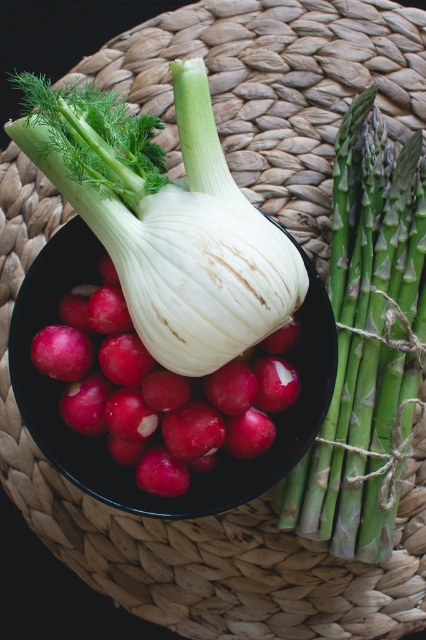
You are standing in front of a vegetable display and see a point marked at coordinates (368, 342). Based on the scene description, what vegetable is located at this point?

The point at (368, 342) indicates the location of the green textured asparagus at right.

You are setting up a vegetable display at a farmer market. You have a white matte fennel bulb at center and a green textured asparagus at right. Which vegetable is shorter?

The white matte fennel bulb at center is not as tall as the green textured asparagus at right, so the white matte fennel bulb at center is shorter.